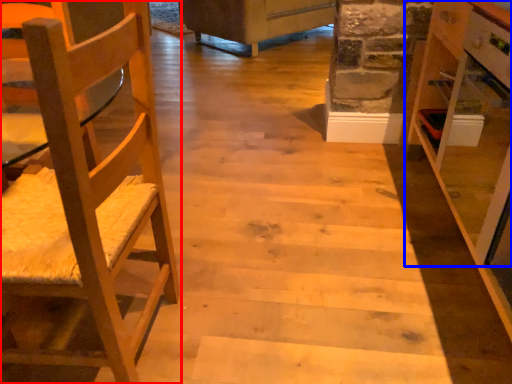
Question: Which object appears farthest to the camera in this image, chair (highlighted by a red box) or cabinetry (highlighted by a blue box)?

Choices:
 (A) chair
 (B) cabinetry

Answer: (B)